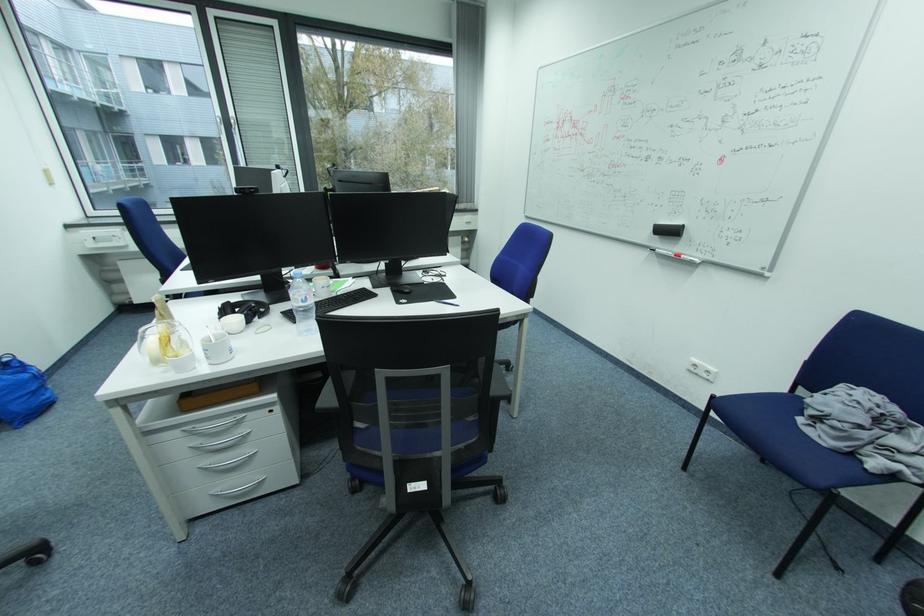
Image resolution: width=924 pixels, height=616 pixels. Find the location of `black computer mouse`. black computer mouse is located at coordinates (244, 309).